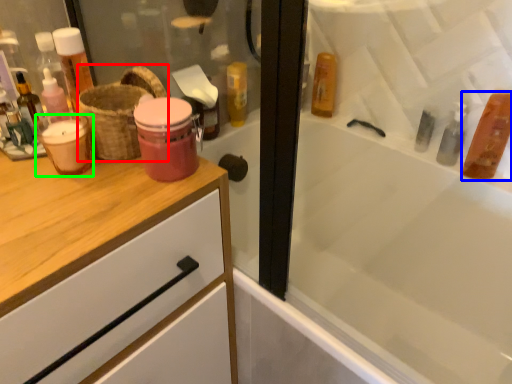
Question: Considering the real-world distances, which object is closest to basket (highlighted by a red box)? mouthwash (highlighted by a blue box) or mouthwash (highlighted by a green box).

Choices:
 (A) mouthwash
 (B) mouthwash

Answer: (B)